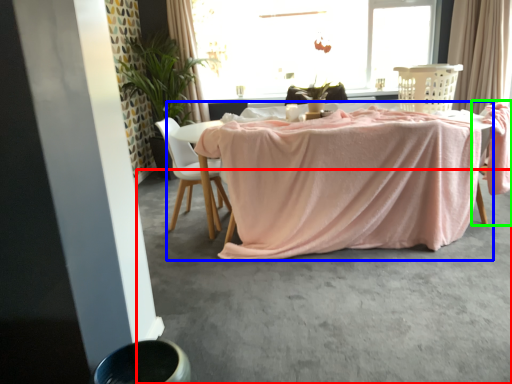
Question: Considering the real-world distances, which object is farthest from concrete (highlighted by a red box)? table (highlighted by a blue box) or armchair (highlighted by a green box)?

Choices:
 (A) table
 (B) armchair

Answer: (B)